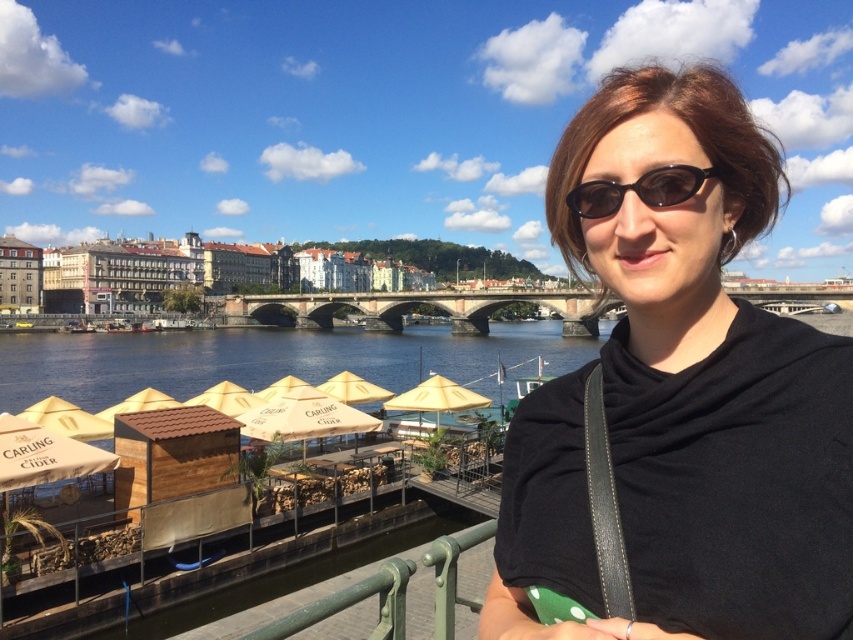
Looking at this image, you are a photographer trying to capture a wide shot of the scene. The green matte railing at lower center and the black plastic sunglasses at upper center are both in your frame. Since you want to emphasize the railing, should you adjust your camera to focus on the wider object? Explain why.

Yes, you should focus on the green matte railing at lower center because its width is larger than the black plastic sunglasses at upper center, making it a more prominent feature in the frame.